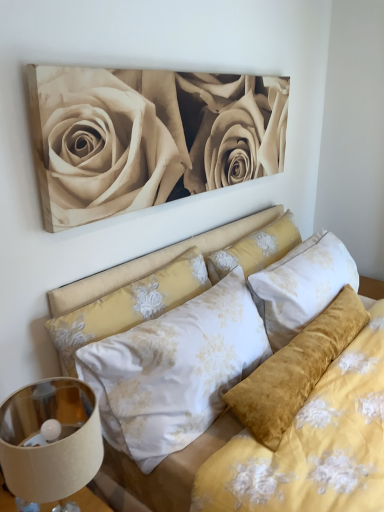
Question: Is velvet yellow pillow at center, the second pillow in the left-to-right sequence, spatially inside metallic beige lampshade at lower left, or outside of it?

Choices:
 (A) outside
 (B) inside

Answer: (A)

Question: From the image's perspective, is velvet yellow pillow at center, which is the 1th pillow from right to left, located above or below metallic beige lampshade at lower left?

Choices:
 (A) below
 (B) above

Answer: (B)

Question: Estimate the real-world distances between objects in this image. Which object is closer to the white floral fabric pillow at center, the second pillow when ordered from right to left?

Choices:
 (A) velvet yellow bed at center
 (B) velvet yellow pillow at center, which is the 1th pillow from right to left
 (C) metallic beige lampshade at lower left
 (D) beige matte/soft canvas at upper center

Answer: (A)

Question: Estimate the real-world distances between objects in this image. Which object is closer to the beige matte/soft canvas at upper center?

Choices:
 (A) white floral fabric pillow at center, placed as the first pillow when sorted from left to right
 (B) velvet yellow pillow at center, the second pillow in the left-to-right sequence
 (C) velvet yellow bed at center
 (D) metallic beige lampshade at lower left

Answer: (C)